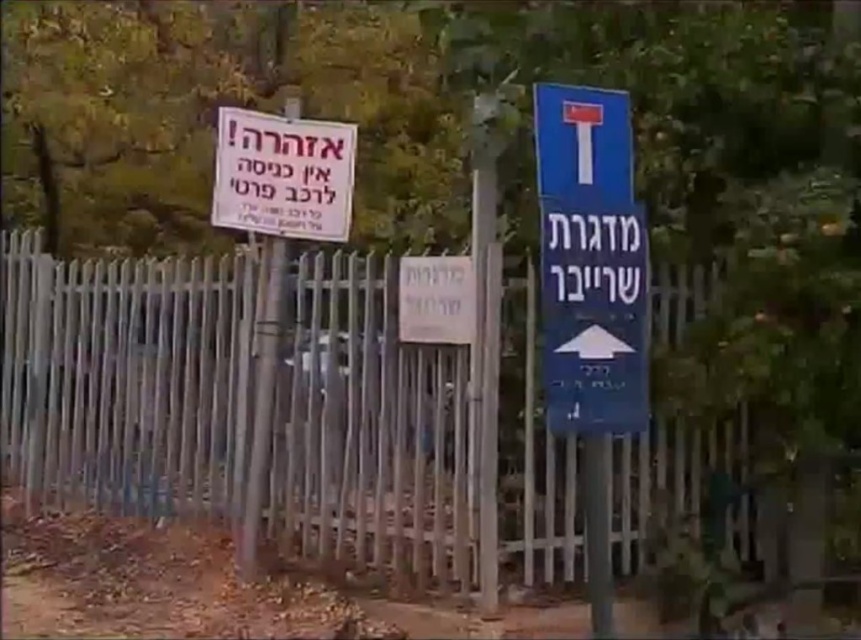
You are a painter who needs to paint both the silver metallic fence at center and the blue plastic sign at right. If you have a limited amount of paint, which object should you prioritize painting first based on their sizes?

The silver metallic fence at center has a larger width than the blue plastic sign at right, so you should prioritize painting the silver metallic fence at center first as it requires more paint.

You are standing in front of the metal fence with two signs. There are two points marked on the image. The first point is at coordinates point (577, 148) and the second point is at point (217, 160). Which point is closer to you?

Point (577, 148) is closer to the camera than point (217, 160).